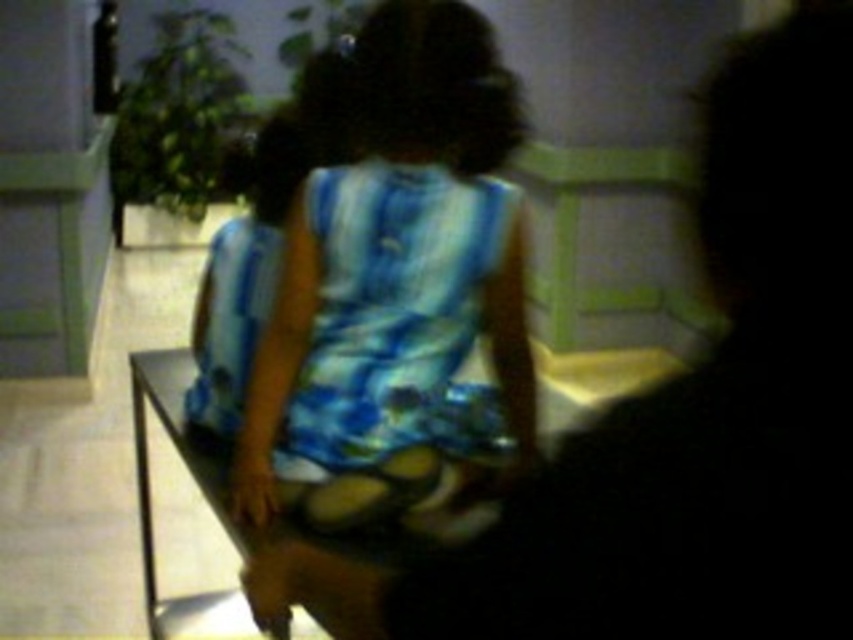
You are standing in the room and want to reach the point marked as point (732,634). If your arm can extend 24 inches, can you reach it without moving your feet?

The distance between point (732,634) and the camera is 28.44 inches. Since your arm can only extend 24 inches, you cannot reach it without moving your feet.